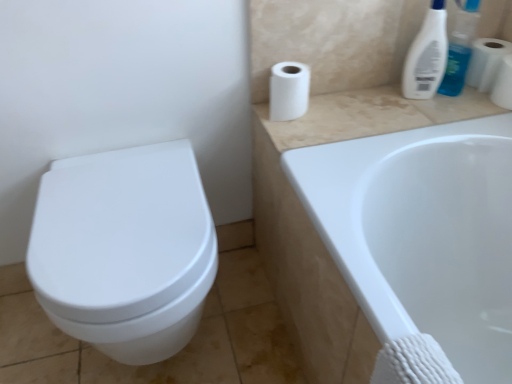
At what (x,y) coordinates should I click in order to perform the action: click on white glossy bottle at upper right. Please return your answer as a coordinate pair (x, y). Looking at the image, I should click on (426, 55).

This screenshot has height=384, width=512. Identify the location of white matte toilet paper at upper right, which is the 1th toilet paper in left-to-right order. (289, 91).

From the image's perspective, is white matte toilet paper at upper right, acting as the 3th toilet paper starting from the right, above or below white matte toilet paper at upper right, the 2th toilet paper from the left?

Based on their image positions, white matte toilet paper at upper right, acting as the 3th toilet paper starting from the right, is located beneath white matte toilet paper at upper right, the 2th toilet paper from the left.

Between white matte toilet paper at upper right, which is the 1th toilet paper in left-to-right order, and white matte toilet paper at upper right, the 2th toilet paper from the left, which one has smaller size?

white matte toilet paper at upper right, the 2th toilet paper from the left, is smaller.

Consider the image. Could white matte toilet paper at upper right, the 2th toilet paper from the left, be considered to be inside white matte toilet paper at upper right, acting as the 3th toilet paper starting from the right?

No, white matte toilet paper at upper right, the 2th toilet paper from the left, is located outside of white matte toilet paper at upper right, acting as the 3th toilet paper starting from the right.

Measure the distance between white matte toilet paper at upper right, acting as the 3th toilet paper starting from the right, and white matte toilet paper at upper right, which ranks as the 2th toilet paper in right-to-left order.

white matte toilet paper at upper right, acting as the 3th toilet paper starting from the right, is 20.57 inches away from white matte toilet paper at upper right, which ranks as the 2th toilet paper in right-to-left order.

Is white glossy bottle at upper right inside or outside of white matte toilet paper at upper right, marked as the 3th toilet paper in a left-to-right arrangement?

white glossy bottle at upper right exists outside the volume of white matte toilet paper at upper right, marked as the 3th toilet paper in a left-to-right arrangement.

Which is more to the right, white glossy bottle at upper right or white matte toilet paper at upper right, the first toilet paper viewed from the right?

white matte toilet paper at upper right, the first toilet paper viewed from the right.

At what (x,y) coordinates should I click in order to perform the action: click on the 2nd toilet paper below the white glossy bottle at upper right (from the image's perspective). Please return your answer as a coordinate pair (x, y). This screenshot has height=384, width=512. Looking at the image, I should click on coord(503,84).

Based on their sizes in the image, would you say white glossy bottle at upper right is bigger or smaller than white matte toilet paper at upper right, marked as the 3th toilet paper in a left-to-right arrangement?

white glossy bottle at upper right is bigger than white matte toilet paper at upper right, marked as the 3th toilet paper in a left-to-right arrangement.

From the image's perspective, which is above, white matte toilet paper at upper right, the 2th toilet paper from the left, or white glossy toilet at left?

white matte toilet paper at upper right, the 2th toilet paper from the left, from the image's perspective.

Can you confirm if white matte toilet paper at upper right, the 2th toilet paper from the left, is wider than white glossy toilet at left?

Incorrect, the width of white matte toilet paper at upper right, the 2th toilet paper from the left, does not surpass that of white glossy toilet at left.

Choose the correct answer: Is white matte toilet paper at upper right, which ranks as the 2th toilet paper in right-to-left order, inside white glossy toilet at left or outside it?

white matte toilet paper at upper right, which ranks as the 2th toilet paper in right-to-left order, cannot be found inside white glossy toilet at left.

Considering the relative positions of white matte toilet paper at upper right, the 2th toilet paper from the left, and white glossy toilet at left in the image provided, is white matte toilet paper at upper right, the 2th toilet paper from the left, to the right of white glossy toilet at left from the viewer's perspective?

Yes, white matte toilet paper at upper right, the 2th toilet paper from the left, is to the right of white glossy toilet at left.

Is white matte toilet paper at upper right, the 2th toilet paper from the left, spatially inside white glossy bottle at upper right, or outside of it?

white matte toilet paper at upper right, the 2th toilet paper from the left, exists outside the volume of white glossy bottle at upper right.

Considering the relative positions of white matte toilet paper at upper right, the 2th toilet paper from the left, and white glossy bottle at upper right in the image provided, is white matte toilet paper at upper right, the 2th toilet paper from the left, behind white glossy bottle at upper right?

Yes, it is.

Is white matte toilet paper at upper right, the 2th toilet paper from the left, facing towards white glossy bottle at upper right?

Yes, white matte toilet paper at upper right, the 2th toilet paper from the left, is aimed at white glossy bottle at upper right.

Based on the photo, is beige marble counter top at upper right at the back of white matte toilet paper at upper right, acting as the 3th toilet paper starting from the right?

No, white matte toilet paper at upper right, acting as the 3th toilet paper starting from the right, is not facing away from beige marble counter top at upper right.

Are white matte toilet paper at upper right, acting as the 3th toilet paper starting from the right, and beige marble counter top at upper right beside each other?

There is a gap between white matte toilet paper at upper right, acting as the 3th toilet paper starting from the right, and beige marble counter top at upper right.

From a real-world perspective, is white matte toilet paper at upper right, acting as the 3th toilet paper starting from the right, below beige marble counter top at upper right?

Incorrect, from a real-world perspective, white matte toilet paper at upper right, acting as the 3th toilet paper starting from the right, is higher than beige marble counter top at upper right.

Visually, is white glossy bottle at upper right positioned to the left or to the right of white matte toilet paper at upper right, which is the 1th toilet paper in left-to-right order?

Based on their positions, white glossy bottle at upper right is located to the right of white matte toilet paper at upper right, which is the 1th toilet paper in left-to-right order.

From the picture: Considering the sizes of objects white glossy bottle at upper right and white matte toilet paper at upper right, which is the 1th toilet paper in left-to-right order, in the image provided, who is smaller, white glossy bottle at upper right or white matte toilet paper at upper right, which is the 1th toilet paper in left-to-right order,?

white matte toilet paper at upper right, which is the 1th toilet paper in left-to-right order.

How many degrees apart are the facing directions of white glossy bottle at upper right and white matte toilet paper at upper right, which is the 1th toilet paper in left-to-right order?

white glossy bottle at upper right and white matte toilet paper at upper right, which is the 1th toilet paper in left-to-right order, are facing 0.0107 degrees away from each other.

From the image's perspective, does white glossy bottle at upper right appear higher than white matte toilet paper at upper right, acting as the 3th toilet paper starting from the right?

Yes.

Are white glossy toilet at left and white matte toilet paper at upper right, the first toilet paper viewed from the right, located far from each other?

Yes, white glossy toilet at left and white matte toilet paper at upper right, the first toilet paper viewed from the right, are quite far apart.

Does white glossy toilet at left contain white matte toilet paper at upper right, marked as the 3th toilet paper in a left-to-right arrangement?

No, white matte toilet paper at upper right, marked as the 3th toilet paper in a left-to-right arrangement, is not a part of white glossy toilet at left.

From a real-world perspective, is white glossy toilet at left under white matte toilet paper at upper right, the first toilet paper viewed from the right?

Correct, in the physical world, white glossy toilet at left is lower than white matte toilet paper at upper right, the first toilet paper viewed from the right.

Between white glossy toilet at left and white matte toilet paper at upper right, the first toilet paper viewed from the right, which one has more height?

With more height is white glossy toilet at left.

From the image's perspective, starting from the white matte toilet paper at upper right, acting as the 3th toilet paper starting from the right, which toilet paper is the 2nd one above? Please provide its 2D coordinates.

[(486, 62)]

This screenshot has height=384, width=512. I want to click on cleaning product above the white matte toilet paper at upper right, marked as the 3th toilet paper in a left-to-right arrangement (from a real-world perspective), so click(x=426, y=55).

Looking at the image, which one is located further to white glossy bottle at upper right, white matte toilet paper at upper right, the first toilet paper viewed from the right, or white matte toilet paper at upper right, acting as the 3th toilet paper starting from the right?

white matte toilet paper at upper right, acting as the 3th toilet paper starting from the right, is further to white glossy bottle at upper right.

When comparing their distances from white matte toilet paper at upper right, the 2th toilet paper from the left, does white matte toilet paper at upper right, the first toilet paper viewed from the right, or white glossy bottle at upper right seem closer?

white matte toilet paper at upper right, the first toilet paper viewed from the right.

When comparing their distances from white glossy bottle at upper right, does white glossy toilet at left or white matte toilet paper at upper right, marked as the 3th toilet paper in a left-to-right arrangement, seem closer?

Based on the image, white matte toilet paper at upper right, marked as the 3th toilet paper in a left-to-right arrangement, appears to be nearer to white glossy bottle at upper right.

When comparing their distances from beige marble counter top at upper right, does white glossy toilet at left or white matte toilet paper at upper right, which ranks as the 2th toilet paper in right-to-left order, seem further?

white glossy toilet at left lies further to beige marble counter top at upper right than the other object.

When comparing their distances from white matte toilet paper at upper right, which ranks as the 2th toilet paper in right-to-left order, does beige marble counter top at upper right or white matte toilet paper at upper right, marked as the 3th toilet paper in a left-to-right arrangement, seem closer?

The object closer to white matte toilet paper at upper right, which ranks as the 2th toilet paper in right-to-left order, is white matte toilet paper at upper right, marked as the 3th toilet paper in a left-to-right arrangement.

Estimate the real-world distances between objects in this image. Which object is further from white matte toilet paper at upper right, which is the 1th toilet paper in left-to-right order, white glossy bottle at upper right or white matte toilet paper at upper right, the first toilet paper viewed from the right?

white matte toilet paper at upper right, the first toilet paper viewed from the right.

Estimate the real-world distances between objects in this image. Which object is closer to white matte toilet paper at upper right, the 2th toilet paper from the left, white matte toilet paper at upper right, which is the 1th toilet paper in left-to-right order, or beige marble counter top at upper right?

The object closer to white matte toilet paper at upper right, the 2th toilet paper from the left, is beige marble counter top at upper right.

Based on their spatial positions, is white matte toilet paper at upper right, which ranks as the 2th toilet paper in right-to-left order, or white glossy bottle at upper right closer to white matte toilet paper at upper right, which is the 1th toilet paper in left-to-right order?

Among the two, white glossy bottle at upper right is located nearer to white matte toilet paper at upper right, which is the 1th toilet paper in left-to-right order.

This screenshot has height=384, width=512. In order to click on toilet paper between white glossy toilet at left and beige marble counter top at upper right from left to right in this screenshot , I will do [289, 91].

The height and width of the screenshot is (384, 512). In order to click on cleaning product between white matte toilet paper at upper right, acting as the 3th toilet paper starting from the right, and white matte toilet paper at upper right, marked as the 3th toilet paper in a left-to-right arrangement, from left to right in this screenshot , I will do `click(426, 55)`.

I want to click on cleaning product between white glossy toilet at left and white matte toilet paper at upper right, the first toilet paper viewed from the right, so click(426, 55).

The width and height of the screenshot is (512, 384). What are the coordinates of `toilet paper situated between white matte toilet paper at upper right, acting as the 3th toilet paper starting from the right, and white matte toilet paper at upper right, marked as the 3th toilet paper in a left-to-right arrangement, from left to right` in the screenshot? It's located at (486, 62).